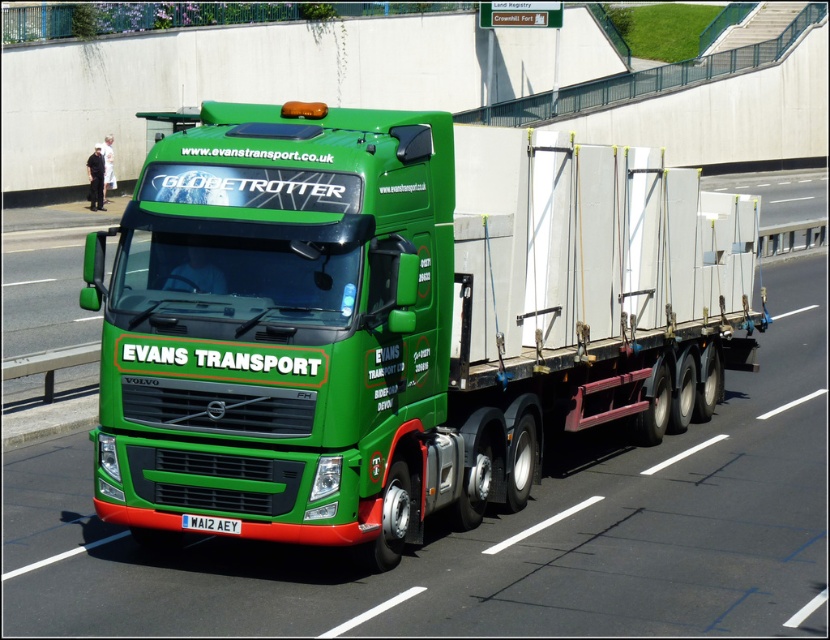
Question: Which point is closer to the camera taking this photo?

Choices:
 (A) (189, 518)
 (B) (251, 346)

Answer: (B)

Question: Is green matte truck at center in front of white plastic license plate at center?

Choices:
 (A) yes
 (B) no

Answer: (B)

Question: Does green matte truck at center lie in front of white plastic license plate at center?

Choices:
 (A) no
 (B) yes

Answer: (A)

Question: Among these points, which one is nearest to the camera?

Choices:
 (A) (204, 516)
 (B) (355, 284)

Answer: (B)

Question: Can you confirm if green matte truck at center is positioned above white plastic license plate at center?

Choices:
 (A) no
 (B) yes

Answer: (B)